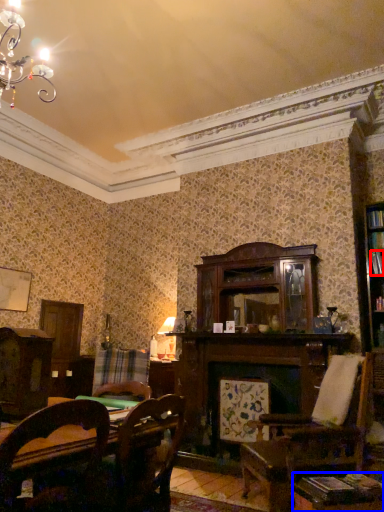
Question: Among these objects, which one is nearest to the camera, book (highlighted by a red box) or table (highlighted by a blue box)?

Choices:
 (A) book
 (B) table

Answer: (B)